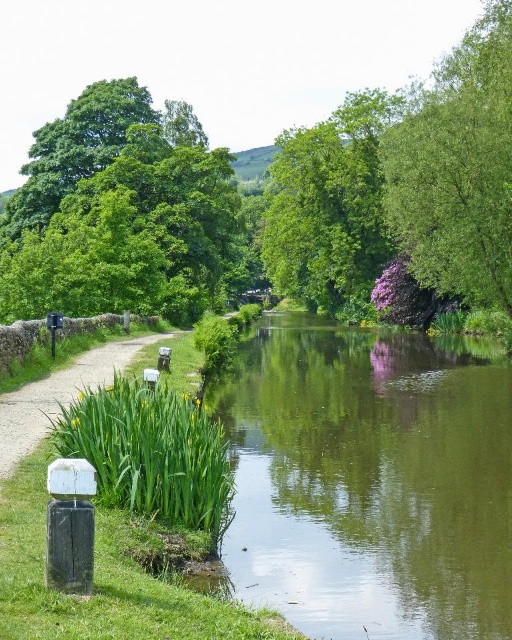
Based on the photo, who is positioned more to the left, green leafy tree at upper left or white concrete path at lower left?

From the viewer's perspective, green leafy tree at upper left appears more on the left side.

The height and width of the screenshot is (640, 512). Find the location of `green leafy tree at upper left`. green leafy tree at upper left is located at coordinates (122, 212).

Is green leafy tree at right thinner than white concrete path at lower left?

No.

Who is shorter, green leafy tree at right or white concrete path at lower left?

Standing shorter between the two is white concrete path at lower left.

Between point (488, 96) and point (104, 358), which one is positioned behind?

The point (488, 96) is behind.

Identify the location of green leafy tree at right. (458, 168).

Is green leafy tree at upper center positioned in front of white concrete path at lower left?

No, green leafy tree at upper center is further to the viewer.

Between green leafy tree at upper center and white concrete path at lower left, which one appears on the left side from the viewer's perspective?

From the viewer's perspective, white concrete path at lower left appears more on the left side.

Which is in front, point (305, 168) or point (53, 392)?

Point (53, 392)

Find the location of a particular element. The image size is (512, 640). green leafy tree at upper center is located at coordinates (330, 205).